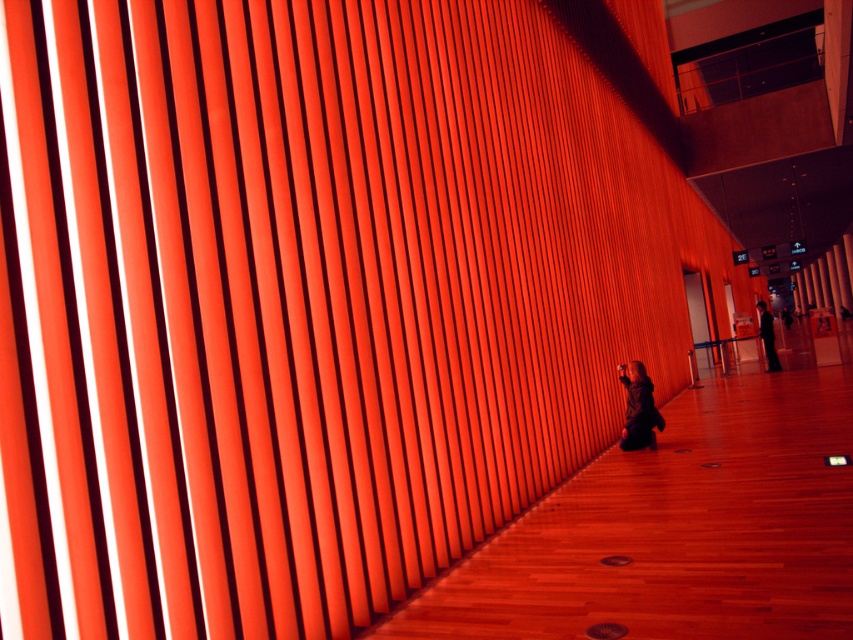
You are organizing a charity event and need to display two items on a table. The items are the matte black jacket at lower center and the dark suit at center. The table has a width of 1.2 meters. Can both items fit side by side on the table without overlapping?

The matte black jacket at lower center has a lesser width compared to the dark suit at center. Since the table is 1.2 meters wide, and the jacket is narrower than the suit, both items can fit side by side as long as their combined widths do not exceed 1.2 meters. However, the exact dimensions of each item are not provided, so it is recommended to measure them first to ensure they fit.

You are standing in the architectural space described. You see the matte black jacket at lower center and the dark suit at center. Which object is positioned lower in the scene?

The matte black jacket at lower center is positioned lower than the dark suit at center.